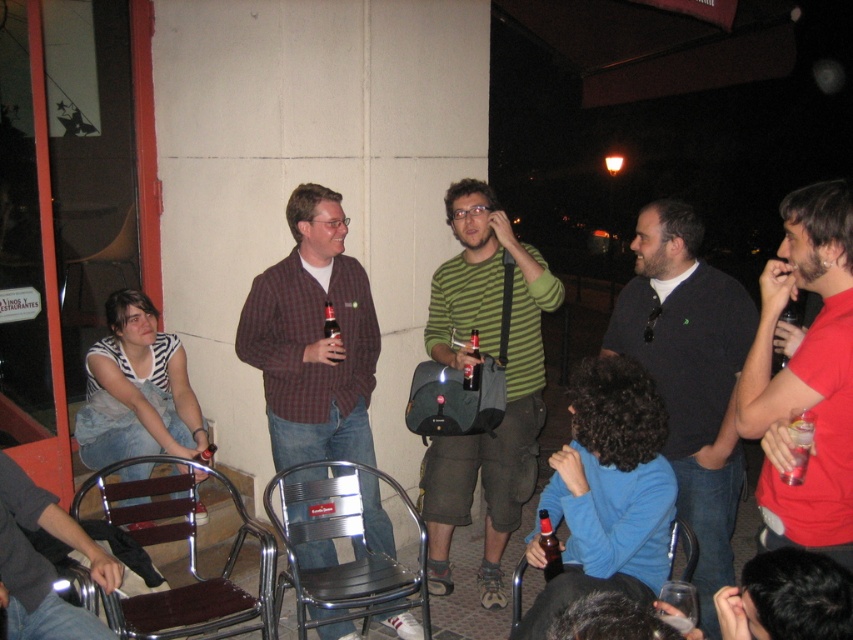
Can you confirm if plaid fabric shirt at center is smaller than dark gray jeans at lower left?

No, plaid fabric shirt at center is not smaller than dark gray jeans at lower left.

You are a GUI agent. You are given a task and a screenshot of the screen. Output one action in this format:
    pyautogui.click(x=<x>, y=<y>)
    Task: Click on the plaid fabric shirt at center
    
    Given the screenshot: What is the action you would take?
    pyautogui.click(x=312, y=339)

Locate an element on the screen. The image size is (853, 640). plaid fabric shirt at center is located at coordinates (312, 339).

Does red shirt at right appear over clear plastic cup at lower right?

Indeed, red shirt at right is positioned over clear plastic cup at lower right.

Is red shirt at right further to the viewer compared to clear plastic cup at lower right?

Yes.

Is point (773, 508) behind point (792, 467)?

Yes, point (773, 508) is farther from viewer.

Find the location of a particular element. This screenshot has width=853, height=640. red shirt at right is located at coordinates (805, 374).

Is metallic silver chair at left wider than brown glass bottle at lower center?

Yes.

Can you confirm if metallic silver chair at left is taller than brown glass bottle at lower center?

Correct, metallic silver chair at left is much taller as brown glass bottle at lower center.

What do you see at coordinates (107, 253) in the screenshot? Image resolution: width=853 pixels, height=640 pixels. I see `metallic silver chair at left` at bounding box center [107, 253].

At what (x,y) coordinates should I click in order to perform the action: click on metallic silver chair at left. Please return your answer as a coordinate pair (x, y). Looking at the image, I should click on (107, 253).